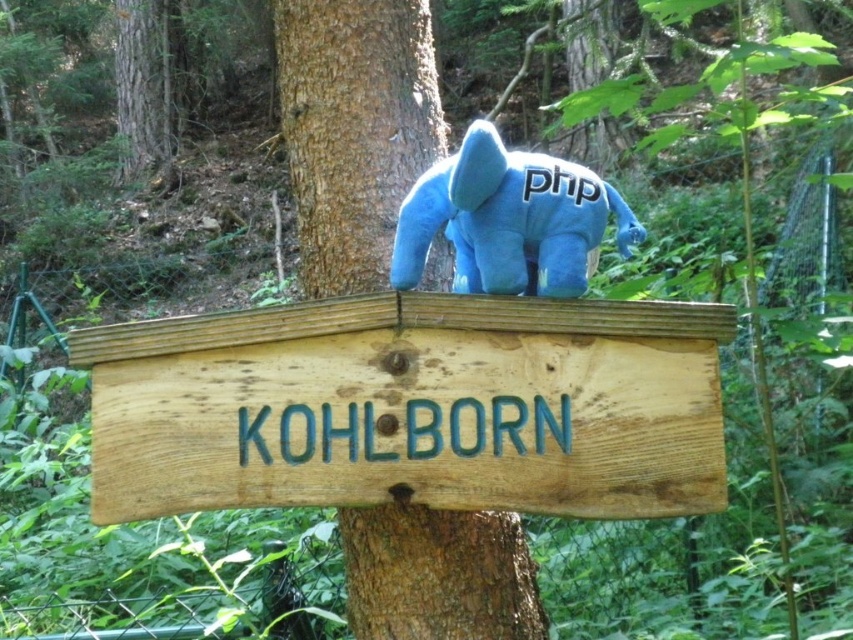
Can you confirm if brown wood sign at center is positioned below brown rough wood sign at center?

Yes.

Looking at this image, which of these two, brown wood sign at center or brown rough wood sign at center, stands taller?

With more height is brown rough wood sign at center.

Where is `brown wood sign at center`? This screenshot has height=640, width=853. brown wood sign at center is located at coordinates (410, 406).

Does brown wood sign at center have a greater height compared to blue plush toy at center?

Yes, brown wood sign at center is taller than blue plush toy at center.

Does brown wood sign at center appear on the right side of blue plush toy at center?

No, brown wood sign at center is not to the right of blue plush toy at center.

Is point (641, 352) farther from viewer compared to point (395, 252)?

Yes, point (641, 352) is farther from viewer.

This screenshot has width=853, height=640. I want to click on brown wood sign at center, so click(410, 406).

Is brown rough wood sign at center positioned in front of blue plush toy at center?

No, brown rough wood sign at center is further to the viewer.

Is brown rough wood sign at center wider than blue plush toy at center?

No, brown rough wood sign at center is not wider than blue plush toy at center.

Find the location of a particular element. The width and height of the screenshot is (853, 640). brown rough wood sign at center is located at coordinates (354, 129).